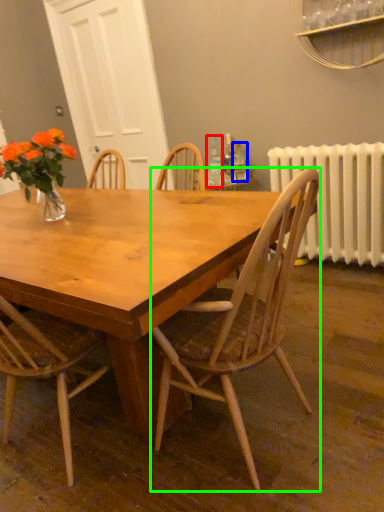
Question: Based on their relative distances, which object is nearer to bottle (highlighted by a red box)? Choose from bottle (highlighted by a blue box) and chair (highlighted by a green box).

Choices:
 (A) bottle
 (B) chair

Answer: (A)